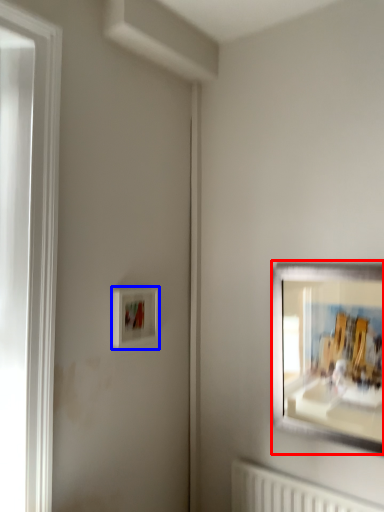
Question: Which object appears closest to the camera in this image, picture frame (highlighted by a red box) or picture frame (highlighted by a blue box)?

Choices:
 (A) picture frame
 (B) picture frame

Answer: (A)